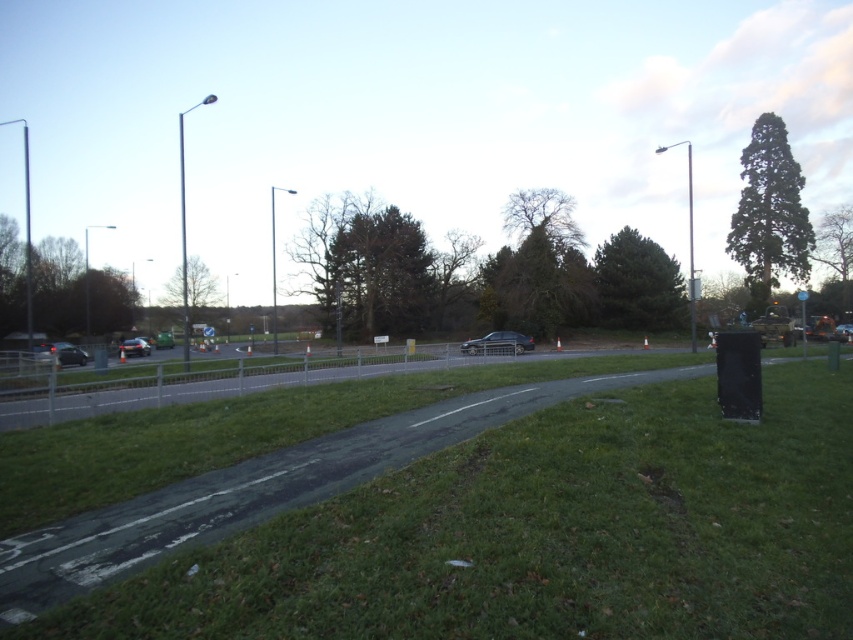
You are a delivery person trying to park your shiny silver car at lower left near the satin silver sedan at center. Can you park your car next to it without any issues?

The satin silver sedan at center is taller than the shiny silver car at lower left, but since height differences don not affect parking next to each other horizontally, you can park your shiny silver car at lower left next to the satin silver sedan at center without any issues.